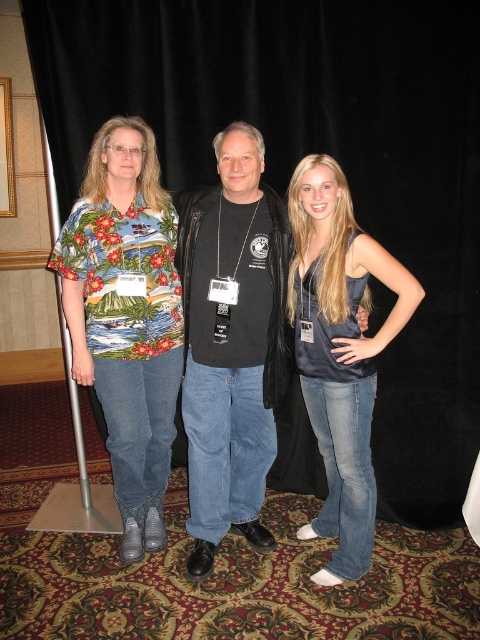
Question: Can you confirm if satin blue tank top at center is wider than silver metallic pole at left?

Choices:
 (A) no
 (B) yes

Answer: (B)

Question: Is floral print shirt at left further to camera compared to silver metallic pole at left?

Choices:
 (A) yes
 (B) no

Answer: (B)

Question: Is black matte shirt at center positioned in front of satin blue tank top at center?

Choices:
 (A) no
 (B) yes

Answer: (A)

Question: Which object is the farthest from the satin blue tank top at center?

Choices:
 (A) silver metallic pole at left
 (B) black matte shirt at center
 (C) floral print shirt at left

Answer: (A)

Question: Which point appears closest to the camera in this image?

Choices:
 (A) (78, 452)
 (B) (157, 540)
 (C) (312, 244)

Answer: (C)

Question: Which of the following is the farthest from the observer?

Choices:
 (A) (251, 406)
 (B) (88, 499)
 (C) (124, 348)
 (D) (319, 310)

Answer: (B)